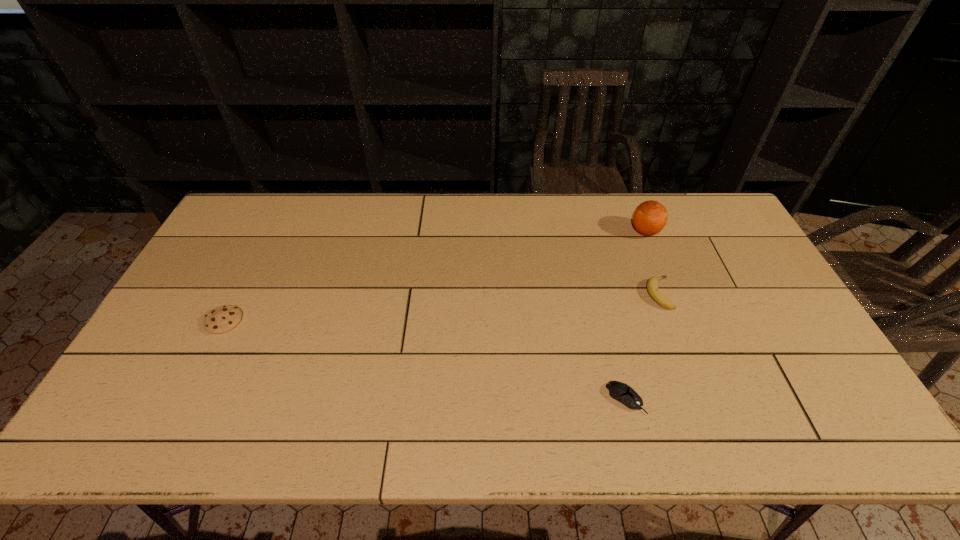
The width and height of the screenshot is (960, 540). What are the coordinates of `the closest object to the leftmost object` in the screenshot? It's located at pyautogui.click(x=619, y=391).

Identify the location of vacant space that satisfies the following two spatial constraints: 1. on the back side of the second object from left to right; 2. on the left side of the banana. The width and height of the screenshot is (960, 540). (599, 293).

Find the location of a particular element. free point that satisfies the following two spatial constraints: 1. on the front side of the computer mouse; 2. on the right side of the cookie is located at coordinates (184, 399).

Where is `vacant space that satisfies the following two spatial constraints: 1. on the back side of the computer mouse; 2. on the right side of the banana`? vacant space that satisfies the following two spatial constraints: 1. on the back side of the computer mouse; 2. on the right side of the banana is located at coordinates (599, 293).

Find the location of a particular element. This screenshot has height=540, width=960. vacant region that satisfies the following two spatial constraints: 1. on the back side of the banana; 2. on the right side of the leftmost object is located at coordinates (238, 293).

I want to click on free space that satisfies the following two spatial constraints: 1. on the back side of the third object from right to left; 2. on the left side of the farthest object, so click(x=584, y=232).